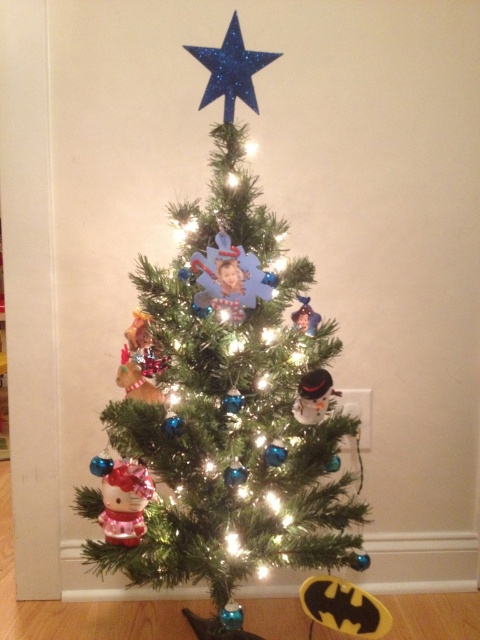
Question: Which point is farther to the camera?

Choices:
 (A) green matte christmas tree at center
 (B) glittery blue star at top
 (C) shiny metallic hello kitty at lower left
 (D) metallic silver ornament at center

Answer: (B)

Question: Which point appears farthest from the camera in this image?

Choices:
 (A) (189, 49)
 (B) (321, 337)

Answer: (A)

Question: Can you confirm if shiny gold ornament at center-left is positioned below metallic silver ornament at center?

Choices:
 (A) yes
 (B) no

Answer: (A)

Question: Is glittery blue star at top to the left of frosted glass snowman at center from the viewer's perspective?

Choices:
 (A) no
 (B) yes

Answer: (B)

Question: Which object appears farthest from the camera in this image?

Choices:
 (A) shiny metallic hello kitty at lower left
 (B) glittery blue star at top
 (C) frosted glass snowman at center

Answer: (B)

Question: Is glittery blue star at top thinner than shiny gold ornament at center-left?

Choices:
 (A) no
 (B) yes

Answer: (A)